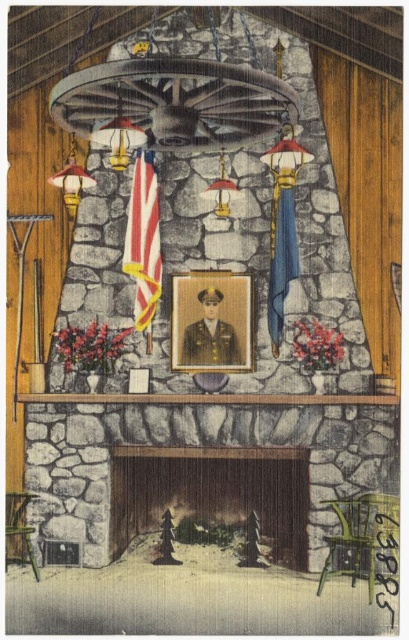
Can you confirm if gold metallic frame at center is wider than american flag at center?

Correct, the width of gold metallic frame at center exceeds that of american flag at center.

Between gold metallic frame at center and american flag at center, which one has less height?

gold metallic frame at center is shorter.

This screenshot has height=640, width=409. Describe the element at coordinates (211, 321) in the screenshot. I see `gold metallic frame at center` at that location.

This screenshot has width=409, height=640. I want to click on gold metallic frame at center, so click(211, 321).

Does gold metallic frame at center have a greater width compared to smooth stone mantle at center?

No, gold metallic frame at center is not wider than smooth stone mantle at center.

Which of these two, gold metallic frame at center or smooth stone mantle at center, stands shorter?

smooth stone mantle at center is shorter.

Which is in front, point (245, 355) or point (116, 401)?

Point (116, 401) is more forward.

The height and width of the screenshot is (640, 409). Identify the location of gold metallic frame at center. (211, 321).

Identify the location of smooth stone mantle at center. [x=209, y=397].

Does smooth stone mantle at center appear under blue fabric flag at center-right?

Yes, smooth stone mantle at center is below blue fabric flag at center-right.

Is point (370, 403) closer to viewer compared to point (287, 284)?

Yes, point (370, 403) is closer to viewer.

This screenshot has width=409, height=640. What are the coordinates of `smooth stone mantle at center` in the screenshot? It's located at click(209, 397).